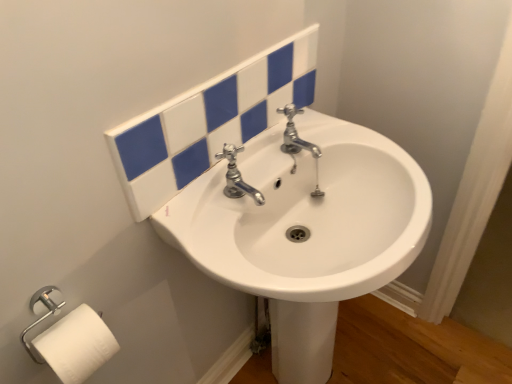
Question: Can you confirm if polished chrome faucet at center is smaller than white matte toilet paper at lower left?

Choices:
 (A) yes
 (B) no

Answer: (A)

Question: Is polished chrome faucet at center placed right next to white matte toilet paper at lower left?

Choices:
 (A) yes
 (B) no

Answer: (B)

Question: Can you confirm if polished chrome faucet at center is wider than white matte toilet paper at lower left?

Choices:
 (A) yes
 (B) no

Answer: (A)

Question: Would you say polished chrome faucet at center contains white matte toilet paper at lower left?

Choices:
 (A) yes
 (B) no

Answer: (B)

Question: Is polished chrome faucet at center shorter than white matte toilet paper at lower left?

Choices:
 (A) yes
 (B) no

Answer: (A)

Question: In the image, is polished chrome faucet at center on the left side or the right side of white matte toilet paper at lower left?

Choices:
 (A) right
 (B) left

Answer: (A)

Question: From the image's perspective, relative to white matte toilet paper at lower left, is polished chrome faucet at center above or below?

Choices:
 (A) above
 (B) below

Answer: (A)

Question: In terms of height, does polished chrome faucet at center look taller or shorter compared to white matte toilet paper at lower left?

Choices:
 (A) tall
 (B) short

Answer: (B)

Question: Is polished chrome faucet at center in front of or behind white matte toilet paper at lower left in the image?

Choices:
 (A) behind
 (B) front

Answer: (A)

Question: Considering the positions of point (41, 354) and point (290, 271), is point (41, 354) closer or farther from the camera than point (290, 271)?

Choices:
 (A) closer
 (B) farther

Answer: (A)

Question: Considering their positions, is white matte toilet paper at lower left located in front of or behind white glossy sink at center?

Choices:
 (A) behind
 (B) front

Answer: (A)

Question: From their relative heights in the image, would you say white matte toilet paper at lower left is taller or shorter than white glossy sink at center?

Choices:
 (A) tall
 (B) short

Answer: (B)

Question: From a real-world perspective, relative to white glossy sink at center, is white matte toilet paper at lower left vertically above or below?

Choices:
 (A) above
 (B) below

Answer: (A)

Question: From a real-world perspective, is white glossy sink at center above or below white matte toilet paper at lower left?

Choices:
 (A) below
 (B) above

Answer: (A)

Question: Considering the positions of white glossy sink at center and white matte toilet paper at lower left in the image, is white glossy sink at center wider or thinner than white matte toilet paper at lower left?

Choices:
 (A) thin
 (B) wide

Answer: (B)